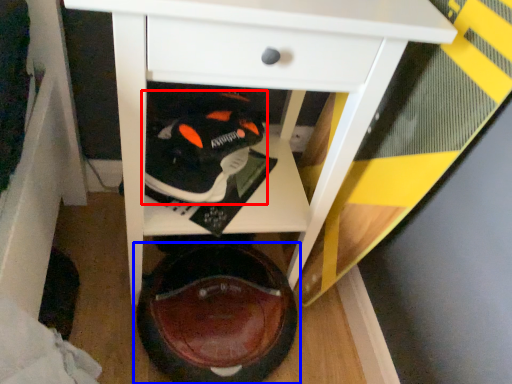
Question: Which object is further to the camera taking this photo, footwear (highlighted by a red box) or footwear (highlighted by a blue box)?

Choices:
 (A) footwear
 (B) footwear

Answer: (A)